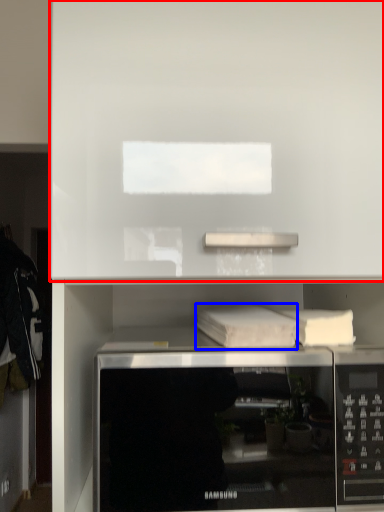
Question: Which object is further to the camera taking this photo, cabinet (highlighted by a red box) or book (highlighted by a blue box)?

Choices:
 (A) cabinet
 (B) book

Answer: (B)